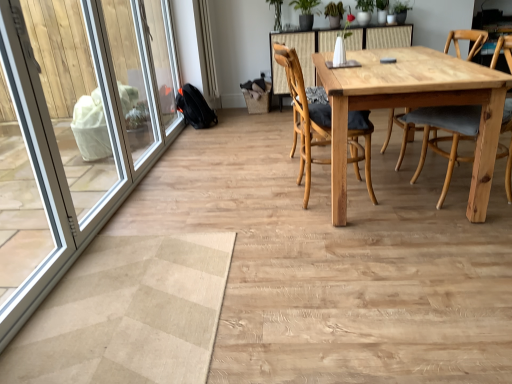
Question: Is wooden chair at center, which is the first chair from left to right, next to green leafy plant at upper center?

Choices:
 (A) yes
 (B) no

Answer: (B)

Question: Does wooden chair at center, the 2th chair positioned from the right, come behind green leafy plant at upper center?

Choices:
 (A) no
 (B) yes

Answer: (A)

Question: Is wooden chair at center, which is the first chair from left to right, not within green leafy plant at upper center?

Choices:
 (A) yes
 (B) no

Answer: (A)

Question: Is green leafy plant at upper center completely or partially inside wooden chair at center, the 2th chair positioned from the right?

Choices:
 (A) no
 (B) yes

Answer: (A)

Question: From the image's perspective, is wooden chair at center, which is the first chair from left to right, above green leafy plant at upper center?

Choices:
 (A) yes
 (B) no

Answer: (B)

Question: Relative to natural wood table at center, is light brown wood chair at center, the second chair when ordered from left to right, in front or behind?

Choices:
 (A) front
 (B) behind

Answer: (B)

Question: Is light brown wood chair at center, acting as the first chair starting from the right, taller or shorter than natural wood table at center?

Choices:
 (A) short
 (B) tall

Answer: (B)

Question: Considering the relative positions of light brown wood chair at center, acting as the first chair starting from the right, and natural wood table at center in the image provided, is light brown wood chair at center, acting as the first chair starting from the right, to the left or to the right of natural wood table at center?

Choices:
 (A) left
 (B) right

Answer: (B)

Question: In terms of width, does light brown wood chair at center, the second chair when ordered from left to right, look wider or thinner when compared to natural wood table at center?

Choices:
 (A) thin
 (B) wide

Answer: (A)

Question: From a real-world perspective, is white plastic screen door at left physically located above or below natural wood table at center?

Choices:
 (A) below
 (B) above

Answer: (B)

Question: Is point coord(83,79) closer or farther from the camera than point coord(414,56)?

Choices:
 (A) farther
 (B) closer

Answer: (A)

Question: Considering the positions of white plastic screen door at left and natural wood table at center in the image, is white plastic screen door at left bigger or smaller than natural wood table at center?

Choices:
 (A) small
 (B) big

Answer: (A)

Question: Do you think white plastic screen door at left is within natural wood table at center, or outside of it?

Choices:
 (A) inside
 (B) outside

Answer: (B)

Question: In terms of size, does green leafy plant at upper center appear bigger or smaller than wooden chair at center, the 2th chair positioned from the right?

Choices:
 (A) big
 (B) small

Answer: (B)

Question: From the image's perspective, is green leafy plant at upper center positioned above or below wooden chair at center, the 2th chair positioned from the right?

Choices:
 (A) above
 (B) below

Answer: (A)